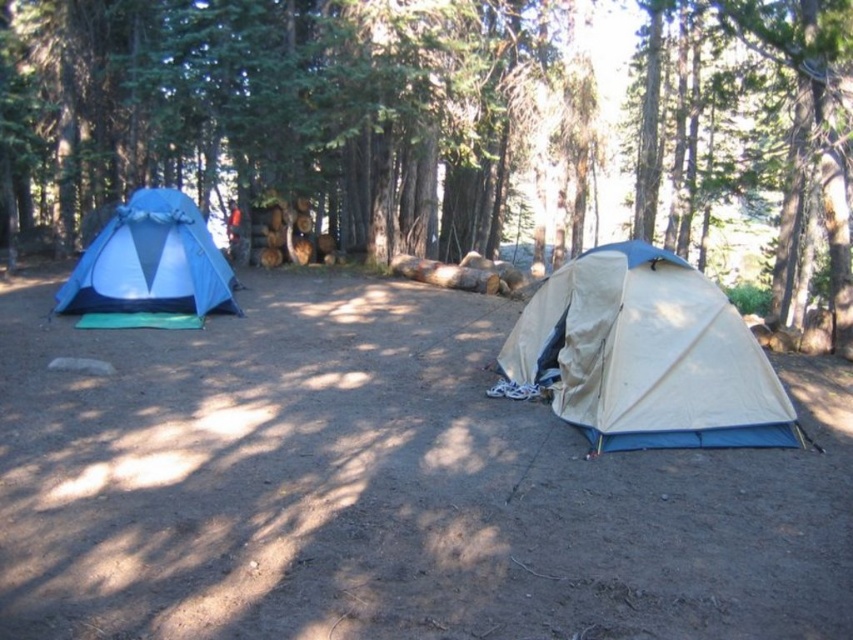
The height and width of the screenshot is (640, 853). In order to click on beige fabric tent at center in this screenshot , I will do `click(645, 355)`.

The height and width of the screenshot is (640, 853). In order to click on beige fabric tent at center in this screenshot , I will do `click(645, 355)`.

At what (x,y) coordinates should I click in order to perform the action: click on beige fabric tent at center. Please return your answer as a coordinate pair (x, y). Image resolution: width=853 pixels, height=640 pixels. Looking at the image, I should click on (645, 355).

Between point (802, 65) and point (181, 248), which one is positioned behind?

Positioned behind is point (181, 248).

Consider the image. Is green matte tent at left below matte blue tent at left?

Actually, green matte tent at left is above matte blue tent at left.

Which is in front, point (650, 74) or point (111, 308)?

Point (111, 308)

Identify the location of green matte tent at left. The width and height of the screenshot is (853, 640). (303, 120).

How much distance is there between green matte tent at left and beige fabric tent at center?

green matte tent at left is 7.56 meters away from beige fabric tent at center.

Does green matte tent at left have a greater width compared to beige fabric tent at center?

Yes.

Locate an element on the screen. green matte tent at left is located at coordinates (303, 120).

This screenshot has height=640, width=853. In order to click on green matte tent at left in this screenshot , I will do `click(303, 120)`.